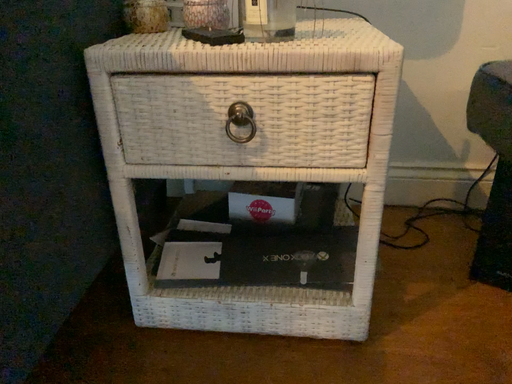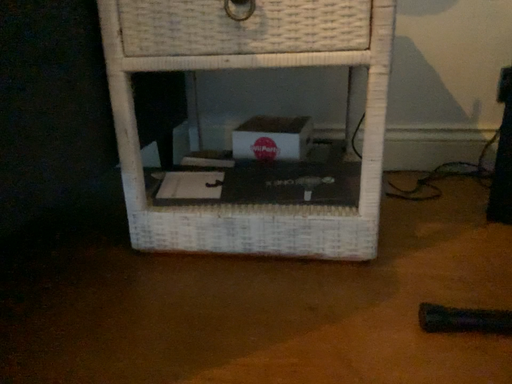
Question: Which way did the camera rotate in the video?

Choices:
 (A) rotated upward
 (B) rotated downward

Answer: (A)